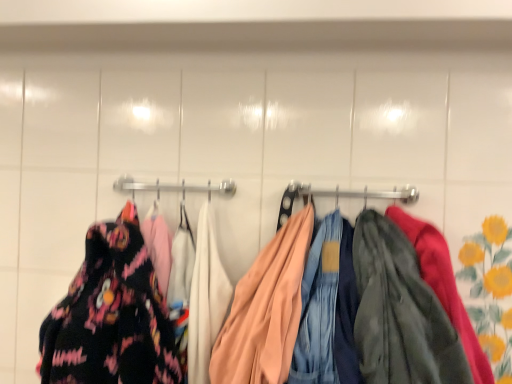
Question: Considering the positions of matte peach jacket at center and floral fabric dress at left in the image, is matte peach jacket at center bigger or smaller than floral fabric dress at left?

Choices:
 (A) small
 (B) big

Answer: (B)

Question: Is matte peach jacket at center spatially inside floral fabric dress at left, or outside of it?

Choices:
 (A) inside
 (B) outside

Answer: (B)

Question: From a real-world perspective, is matte peach jacket at center above or below floral fabric dress at left?

Choices:
 (A) below
 (B) above

Answer: (B)

Question: Based on their positions, is floral fabric dress at left located to the left or right of matte peach jacket at center?

Choices:
 (A) left
 (B) right

Answer: (A)

Question: From a real-world perspective, is floral fabric dress at left physically located above or below matte peach jacket at center?

Choices:
 (A) above
 (B) below

Answer: (B)

Question: Choose the correct answer: Is floral fabric dress at left inside matte peach jacket at center or outside it?

Choices:
 (A) inside
 (B) outside

Answer: (B)

Question: In terms of height, does floral fabric dress at left look taller or shorter compared to matte peach jacket at center?

Choices:
 (A) tall
 (B) short

Answer: (A)